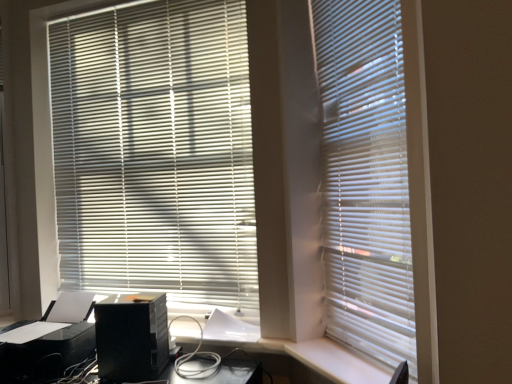
Question: From the image's perspective, does white matte blinds at center, the 2th window blind from the left, appear lower than white plastic screen door at left?

Choices:
 (A) no
 (B) yes

Answer: (B)

Question: Considering the relative sizes of white matte blinds at center, the 2th window blind from the left, and white plastic screen door at left in the image provided, is white matte blinds at center, the 2th window blind from the left, thinner than white plastic screen door at left?

Choices:
 (A) yes
 (B) no

Answer: (A)

Question: From the image's perspective, does white matte blinds at center, positioned as the second window blind in back-to-front order, appear higher than white plastic screen door at left?

Choices:
 (A) no
 (B) yes

Answer: (A)

Question: Is white matte blinds at center, which is the 1th window blind from right to left, taller than white plastic screen door at left?

Choices:
 (A) yes
 (B) no

Answer: (B)

Question: Is white matte blinds at center, which is the 1th window blind from right to left, facing towards white plastic screen door at left?

Choices:
 (A) yes
 (B) no

Answer: (B)

Question: Can you confirm if white matte blinds at center, the 1th window blind when ordered from front to back, is shorter than white plastic screen door at left?

Choices:
 (A) no
 (B) yes

Answer: (B)

Question: Is black plastic printer at lower left outside of white matte blinds at center, which appears as the second window blind when viewed from the right?

Choices:
 (A) yes
 (B) no

Answer: (A)

Question: Is black plastic printer at lower left with white matte blinds at center, which appears as the second window blind when viewed from the right?

Choices:
 (A) no
 (B) yes

Answer: (A)

Question: From the image's perspective, is black plastic printer at lower left below white matte blinds at center, the 1th window blind from the back?

Choices:
 (A) no
 (B) yes

Answer: (B)

Question: Considering the relative positions of black plastic printer at lower left and white matte blinds at center, placed as the 2th window blind when sorted from front to back, in the image provided, is black plastic printer at lower left behind white matte blinds at center, placed as the 2th window blind when sorted from front to back,?

Choices:
 (A) yes
 (B) no

Answer: (B)

Question: Considering the relative positions of black plastic printer at lower left and white matte blinds at center, the 1th window blind from the back, in the image provided, is black plastic printer at lower left to the left of white matte blinds at center, the 1th window blind from the back, from the viewer's perspective?

Choices:
 (A) yes
 (B) no

Answer: (A)

Question: Does black plastic printer at lower left contain white matte blinds at center, which appears as the second window blind when viewed from the right?

Choices:
 (A) no
 (B) yes

Answer: (A)

Question: Can you confirm if white matte blinds at center, which is the 1th window blind from right to left, is wider than black plastic computer tower at lower left?

Choices:
 (A) yes
 (B) no

Answer: (B)